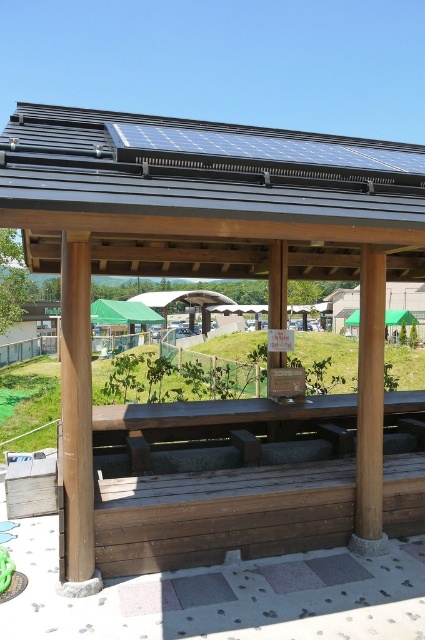
Does black solar panel at upper center have a greater height compared to brown wood pillar at left?

Incorrect, black solar panel at upper center's height is not larger of brown wood pillar at left's.

Does black solar panel at upper center appear under brown wood pillar at left?

No, black solar panel at upper center is not below brown wood pillar at left.

Which is behind, point (96, 202) or point (81, 410)?

Point (81, 410)

This screenshot has height=640, width=425. I want to click on black solar panel at upper center, so click(206, 195).